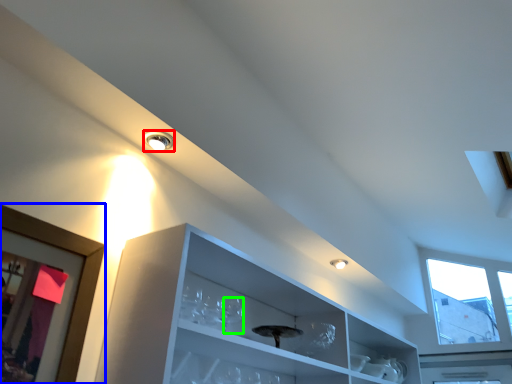
Question: Which is nearer to the droplight (highlighted by a red box)? picture frame (highlighted by a blue box) or wine glass (highlighted by a green box).

Choices:
 (A) picture frame
 (B) wine glass

Answer: (A)